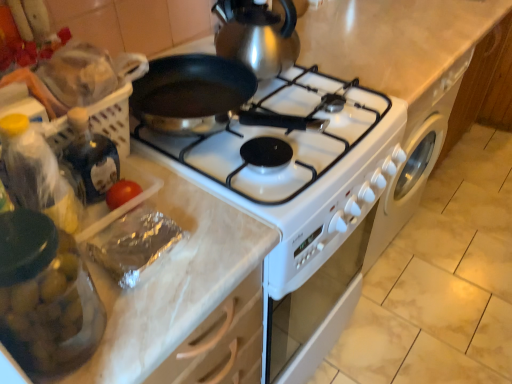
Question: Would you say silver foil meat at lower left is outside transparent glass jar at left?

Choices:
 (A) yes
 (B) no

Answer: (A)

Question: From a real-world perspective, is silver foil meat at lower left on transparent glass jar at left?

Choices:
 (A) no
 (B) yes

Answer: (A)

Question: From the image's perspective, is silver foil meat at lower left under transparent glass jar at left?

Choices:
 (A) no
 (B) yes

Answer: (A)

Question: Can you confirm if silver foil meat at lower left is wider than transparent glass jar at left?

Choices:
 (A) no
 (B) yes

Answer: (B)

Question: Is silver foil meat at lower left smaller than transparent glass jar at left?

Choices:
 (A) yes
 (B) no

Answer: (A)

Question: Considering the relative sizes of silver foil meat at lower left and transparent glass jar at left in the image provided, is silver foil meat at lower left shorter than transparent glass jar at left?

Choices:
 (A) no
 (B) yes

Answer: (B)

Question: Does silver foil meat at lower left appear on the left side of shiny metallic gas stove at center?

Choices:
 (A) no
 (B) yes

Answer: (B)

Question: Is silver foil meat at lower left positioned far away from shiny metallic gas stove at center?

Choices:
 (A) no
 (B) yes

Answer: (A)

Question: Is silver foil meat at lower left smaller than shiny metallic gas stove at center?

Choices:
 (A) yes
 (B) no

Answer: (A)

Question: From the image's perspective, is silver foil meat at lower left beneath shiny metallic gas stove at center?

Choices:
 (A) no
 (B) yes

Answer: (B)

Question: Is silver foil meat at lower left next to shiny metallic gas stove at center and touching it?

Choices:
 (A) yes
 (B) no

Answer: (B)

Question: From a real-world perspective, is silver foil meat at lower left beneath shiny metallic gas stove at center?

Choices:
 (A) yes
 (B) no

Answer: (A)

Question: From the image's perspective, does translucent plastic bottle at left appear lower than transparent glass jar at left?

Choices:
 (A) no
 (B) yes

Answer: (A)